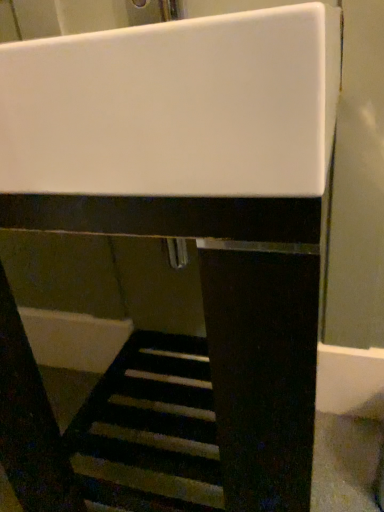
At what (x,y) coordinates should I click in order to perform the action: click on white matte sink at upper center. Please return your answer as a coordinate pair (x, y). The image size is (384, 512). Looking at the image, I should click on (175, 106).

What do you see at coordinates (175, 106) in the screenshot?
I see `white matte sink at upper center` at bounding box center [175, 106].

Locate an element on the screen. This screenshot has width=384, height=512. white matte sink at upper center is located at coordinates (175, 106).